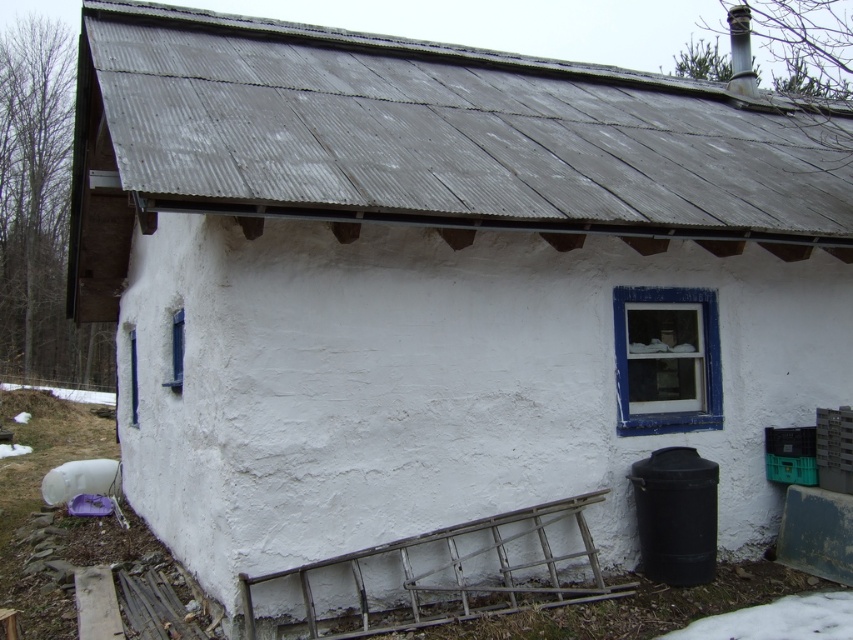
Question: Estimate the real-world distances between objects in this image. Which object is farther from the gray corrugated metal roof at upper center?

Choices:
 (A) blue matte window at left
 (B) white powdery snow at lower right

Answer: (B)

Question: Among these objects, which one is nearest to the camera?

Choices:
 (A) gray corrugated metal roof at upper center
 (B) blue painted wood window at right
 (C) blue matte window at left

Answer: (A)

Question: Does gray corrugated metal roof at upper center have a larger size compared to white powdery snow at lower right?

Choices:
 (A) yes
 (B) no

Answer: (A)

Question: Which point is farther to the camera?

Choices:
 (A) (689, 353)
 (B) (703, 634)
 (C) (717, 232)
 (D) (175, 372)

Answer: (D)

Question: In this image, where is gray corrugated metal roof at upper center located relative to white powdery snow at lower right?

Choices:
 (A) above
 (B) below

Answer: (A)

Question: Does white powdery snow at lower right have a lesser width compared to blue matte window at left?

Choices:
 (A) yes
 (B) no

Answer: (B)